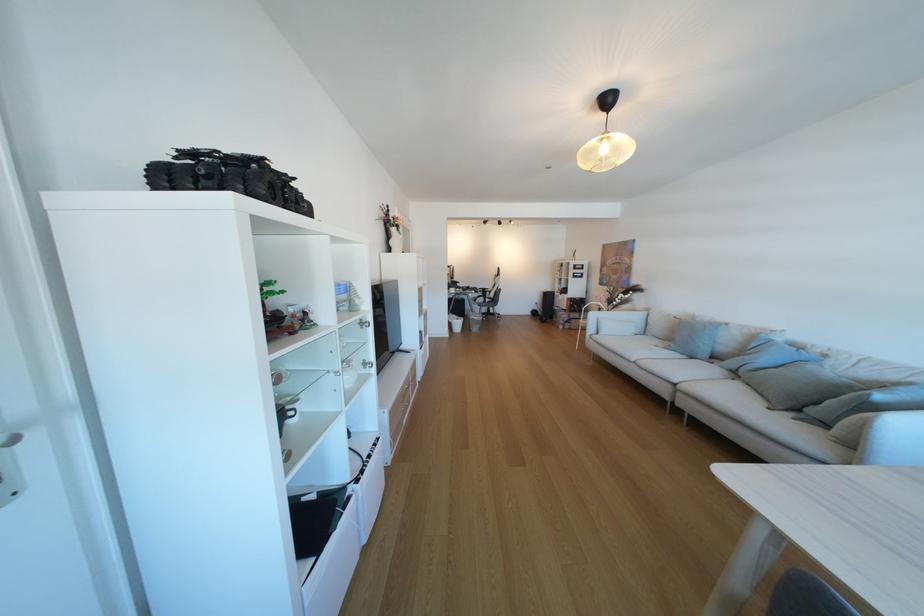
The image size is (924, 616). I want to click on white bin handle, so click(475, 323).